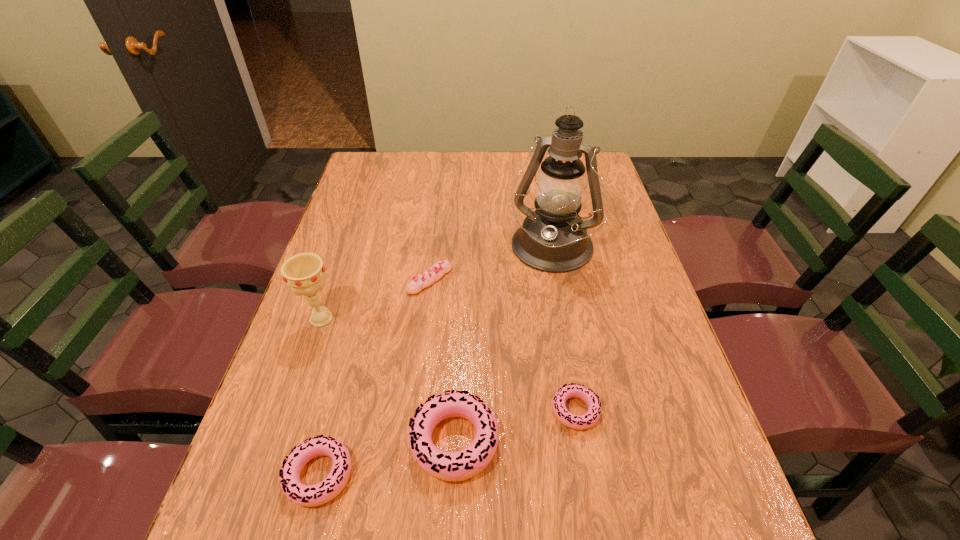
This screenshot has height=540, width=960. I want to click on vacant space located on the left of the shortest doughnut, so click(x=374, y=410).

Image resolution: width=960 pixels, height=540 pixels. Find the location of `vacant space located 0.290m on the right of the eclair`. vacant space located 0.290m on the right of the eclair is located at coordinates (558, 280).

You are a GUI agent. You are given a task and a screenshot of the screen. Output one action in this format:
    pyautogui.click(x=<x>, y=<y>)
    Task: Click on the free region located on the front of the chalice
    This screenshot has height=540, width=960.
    Given the screenshot: What is the action you would take?
    pyautogui.click(x=308, y=357)

At what (x,y) coordinates should I click in order to perform the action: click on vacant area situated 0.050m on the back of the oil lamp. Please return your answer as a coordinate pair (x, y). Image resolution: width=960 pixels, height=540 pixels. Looking at the image, I should click on (544, 212).

Identify the location of doughnut situated at the left edge. The width and height of the screenshot is (960, 540). (305, 495).

The height and width of the screenshot is (540, 960). Find the location of `chalice at the left edge`. chalice at the left edge is located at coordinates (305, 274).

Where is `object at the right edge`? The height and width of the screenshot is (540, 960). object at the right edge is located at coordinates (553, 238).

The height and width of the screenshot is (540, 960). What are the coordinates of `object present at the near left corner` in the screenshot? It's located at [305, 495].

The width and height of the screenshot is (960, 540). Identify the location of free space at the far edge of the desktop. (442, 175).

The image size is (960, 540). Find the location of `vacant space at the left edge`. vacant space at the left edge is located at coordinates (364, 199).